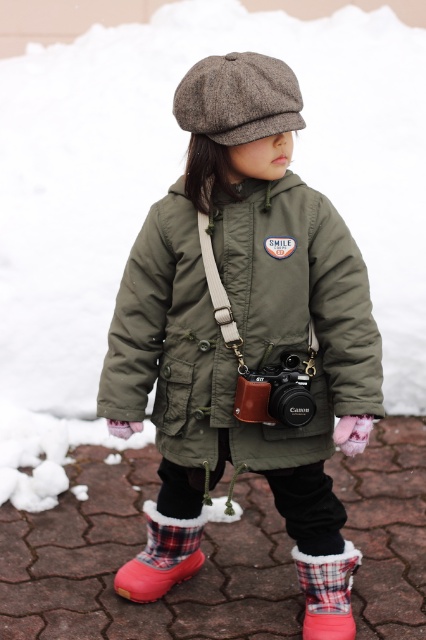
Question: Can you confirm if plaid fabric boot at lower center is thinner than matte black camera at center?

Choices:
 (A) no
 (B) yes

Answer: (B)

Question: Among these points, which one is nearest to the camera?

Choices:
 (A) (158, 513)
 (B) (212, 106)

Answer: (B)

Question: Can you confirm if brown wool beret at center is positioned to the right of matte black camera at center?

Choices:
 (A) no
 (B) yes

Answer: (A)

Question: Which point is farther to the camera?

Choices:
 (A) matte black camera at center
 (B) plaid rubber boot at lower center
 (C) plaid fabric boot at lower center

Answer: (B)

Question: Which point is closer to the camera taking this photo?

Choices:
 (A) (181, 188)
 (B) (238, 403)
 (C) (241, 104)
 (D) (166, 584)

Answer: (C)

Question: Can you confirm if plaid fabric boot at lower center is positioned to the left of matte black camera at center?

Choices:
 (A) no
 (B) yes

Answer: (A)